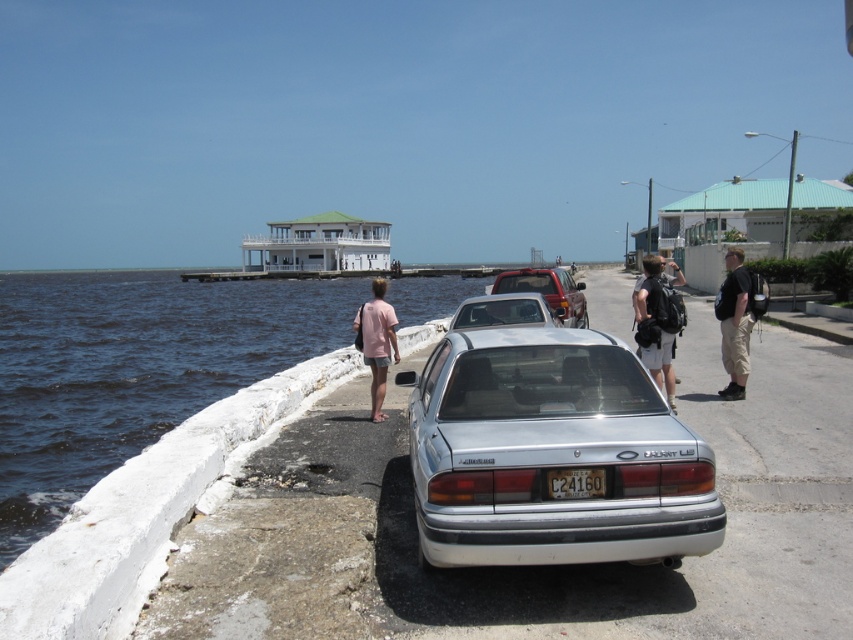
You are a GUI agent. You are given a task and a screenshot of the screen. Output one action in this format:
    pyautogui.click(x=<x>, y=<y>)
    Task: Click on the silver metallic sedan at center
    This screenshot has width=853, height=640.
    Given the screenshot: What is the action you would take?
    pyautogui.click(x=550, y=454)

Which of these two, silver metallic sedan at center or black backpack at right, stands taller?

With more height is black backpack at right.

This screenshot has width=853, height=640. I want to click on silver metallic sedan at center, so click(550, 454).

Between silver metallic sedan at center and pink cotton shirt at center, which one is positioned lower?

Positioned lower is silver metallic sedan at center.

Which is in front, point (508, 358) or point (387, 314)?

Point (508, 358) is in front.

Does point (611, 536) come in front of point (373, 378)?

That is True.

I want to click on silver metallic sedan at center, so click(x=550, y=454).

Can you confirm if metallic silver pickup truck at center is shorter than white plastic license plate at center?

No.

Which is more to the right, metallic silver pickup truck at center or white plastic license plate at center?

From the viewer's perspective, metallic silver pickup truck at center appears more on the right side.

Which is behind, point (554, 298) or point (592, 486)?

Positioned behind is point (554, 298).

Locate an element on the screen. The width and height of the screenshot is (853, 640). metallic silver pickup truck at center is located at coordinates (548, 291).